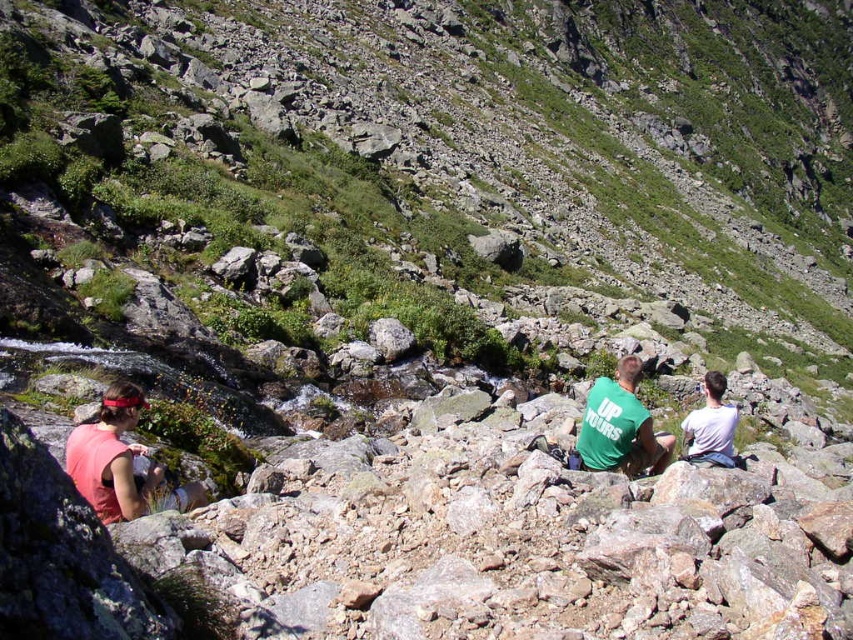
Which is in front, point (625, 436) or point (724, 388)?

Point (625, 436)

Image resolution: width=853 pixels, height=640 pixels. Describe the element at coordinates (619, 426) in the screenshot. I see `green t-shirt at center` at that location.

Where is `green t-shirt at center`? The width and height of the screenshot is (853, 640). green t-shirt at center is located at coordinates (619, 426).